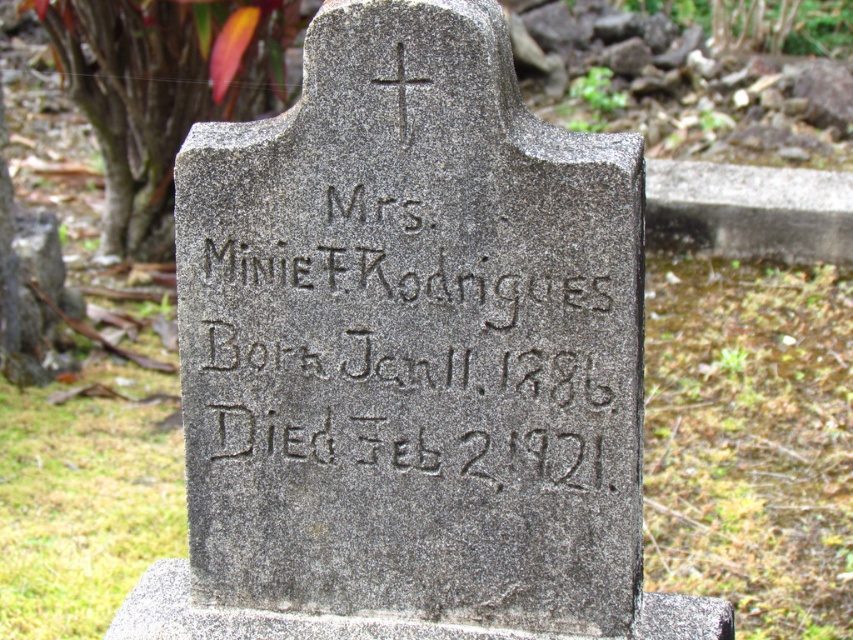
You are standing in a cemetery and see the gray stone gravestone at center and the gray stone inscription at center. Which one is closer to you?

The gray stone gravestone at center is closer to you because it is in front of the gray stone inscription at center.

You are standing in a cemetery and see the gray stone gravestone at center and the gray stone inscription at center. Which object is taller?

The gray stone gravestone at center is much taller than the gray stone inscription at center.